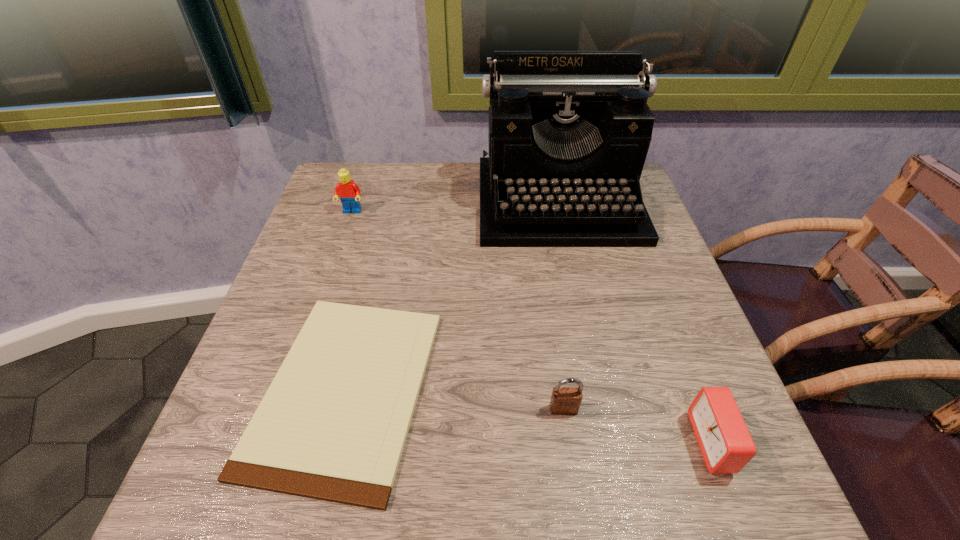
At what (x,y) coordinates should I click in order to perform the action: click on vacant space located on the front-facing side of the alarm clock. Please return your answer as a coordinate pair (x, y). This screenshot has width=960, height=540. Looking at the image, I should click on (503, 442).

You are a GUI agent. You are given a task and a screenshot of the screen. Output one action in this format:
    pyautogui.click(x=<x>, y=<y>)
    Task: Click on the vacant area situated on the right of the clipboard
    The height and width of the screenshot is (540, 960).
    Given the screenshot: What is the action you would take?
    pyautogui.click(x=593, y=389)

This screenshot has width=960, height=540. In order to click on typewriter located in the far edge section of the desktop in this screenshot , I will do `click(569, 131)`.

Where is `Lego situated at the far edge`? Lego situated at the far edge is located at coordinates (349, 193).

You are a GUI agent. You are given a task and a screenshot of the screen. Output one action in this format:
    pyautogui.click(x=<x>, y=<y>)
    Task: Click on the alarm clock that is positioned at the near edge
    The height and width of the screenshot is (540, 960).
    Given the screenshot: What is the action you would take?
    pyautogui.click(x=725, y=442)

Find the location of a particular element. clipboard that is at the near edge is located at coordinates (332, 426).

This screenshot has width=960, height=540. Identify the location of Lego positioned at the left edge. (349, 193).

Locate an element on the screen. The image size is (960, 540). clipboard located at the left edge is located at coordinates (332, 426).

At what (x,y) coordinates should I click in order to perform the action: click on typewriter positioned at the right edge. Please return your answer as a coordinate pair (x, y). The width and height of the screenshot is (960, 540). Looking at the image, I should click on (569, 131).

You are a GUI agent. You are given a task and a screenshot of the screen. Output one action in this format:
    pyautogui.click(x=<x>, y=<y>)
    Task: Click on the alarm clock that is at the right edge
    This screenshot has height=540, width=960.
    Given the screenshot: What is the action you would take?
    click(x=725, y=442)